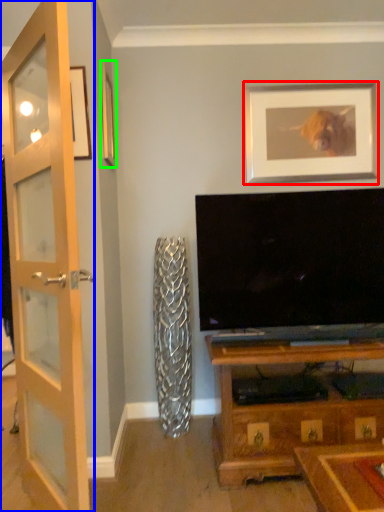
Question: Considering the real-world distances, which object is farthest from picture frame (highlighted by a red box)? door (highlighted by a blue box) or picture frame (highlighted by a green box)?

Choices:
 (A) door
 (B) picture frame

Answer: (A)